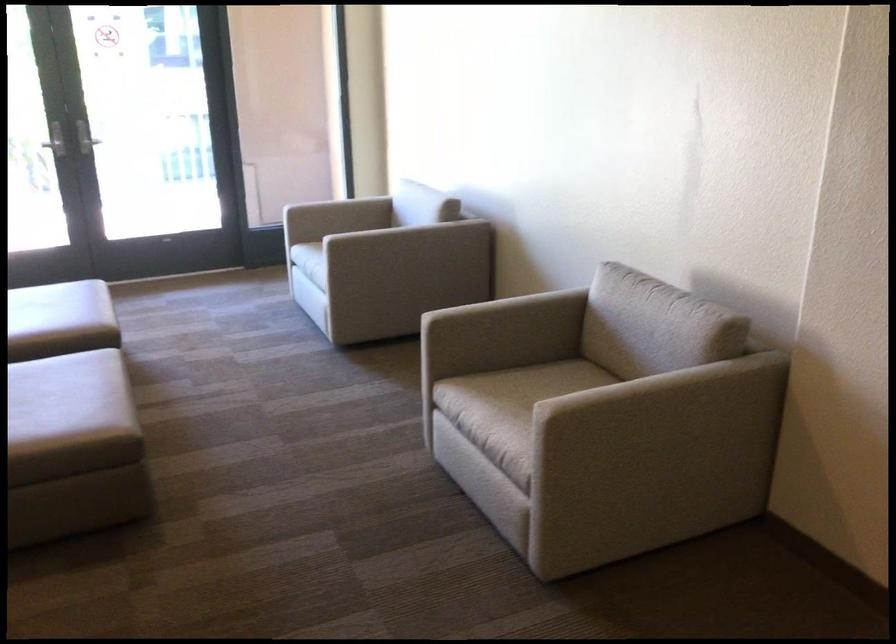
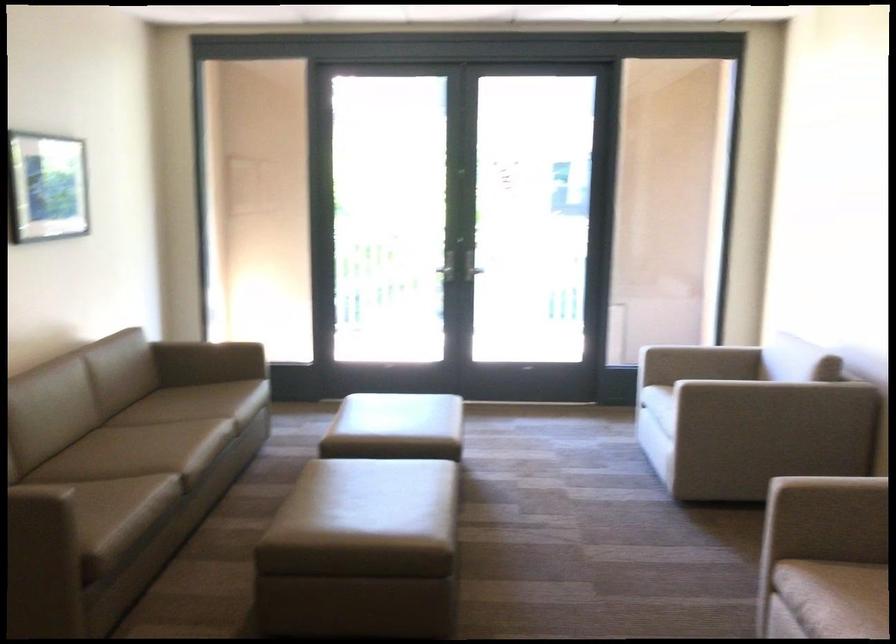
Locate, in the second image, the point that corresponds to the point at 487,389 in the first image.

(856, 591)